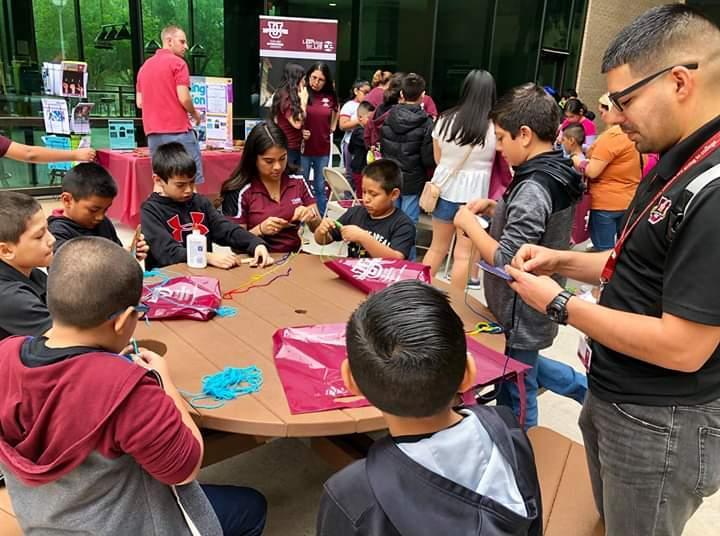
I want to click on magazine, so click(85, 111), click(42, 118), click(70, 73), click(45, 73), click(52, 139), click(85, 141).